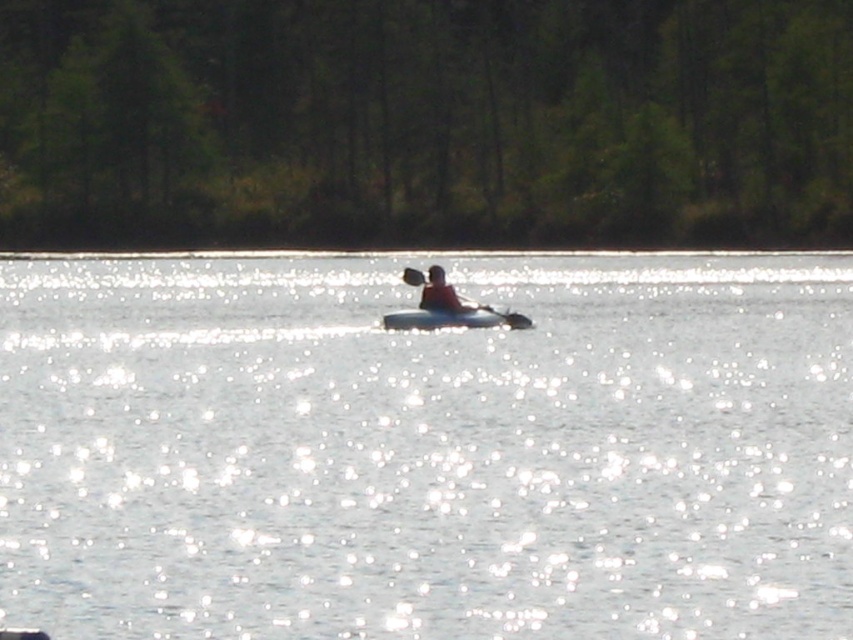
Is glistening water at center closer to camera compared to matte red kayak at center?

Yes, it is.

Between glistening water at center and matte red kayak at center, which one appears on the left side from the viewer's perspective?

From the viewer's perspective, glistening water at center appears more on the left side.

Is point (44, 323) in front of point (426, 300)?

No, (44, 323) is behind (426, 300).

Identify the location of glistening water at center. (426, 449).

Which of these two, glistening water at center or black rubber paddle at center, stands shorter?

With less height is black rubber paddle at center.

The height and width of the screenshot is (640, 853). What are the coordinates of `glistening water at center` in the screenshot? It's located at (426, 449).

Where is `glistening water at center`? This screenshot has width=853, height=640. glistening water at center is located at coordinates (426, 449).

Identify the location of black rubber paddle at center. (447, 307).

Who is positioned more to the right, black rubber paddle at center or matte red kayak at center?

black rubber paddle at center is more to the right.

You are a GUI agent. You are given a task and a screenshot of the screen. Output one action in this format:
    pyautogui.click(x=<x>, y=<y>)
    Task: Click on the black rubber paddle at center
    The height and width of the screenshot is (640, 853).
    Given the screenshot: What is the action you would take?
    pyautogui.click(x=447, y=307)